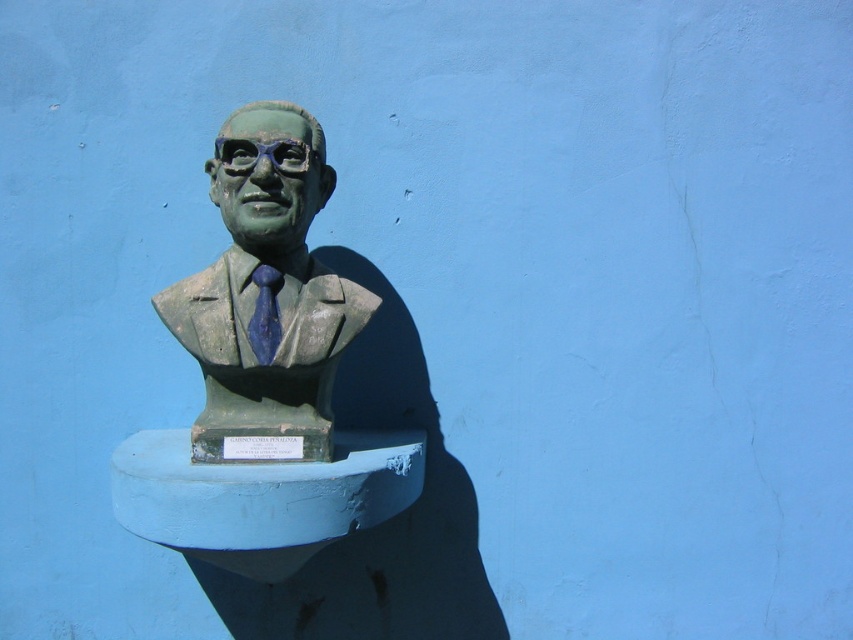
You are an art conservator examining the sculpture. You notice the green stone bust at center and the blue matte tie at center. Which object is closer to the viewer?

The green stone bust at center is closer to the viewer than the blue matte tie at center.